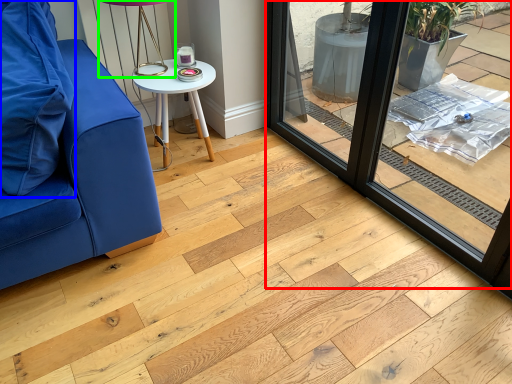
Question: Considering the real-world distances, which object is closest to window frame (highlighted by a red box)? pillow (highlighted by a blue box) or table lamp (highlighted by a green box).

Choices:
 (A) pillow
 (B) table lamp

Answer: (B)